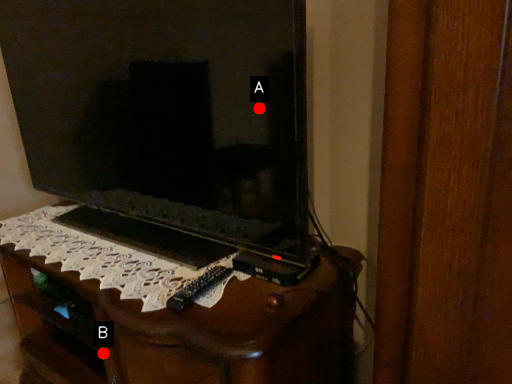
Question: Two points are circled on the image, labeled by A and B beside each circle. Which point is closer to the camera taking this photo?

Choices:
 (A) A is closer
 (B) B is closer

Answer: (A)